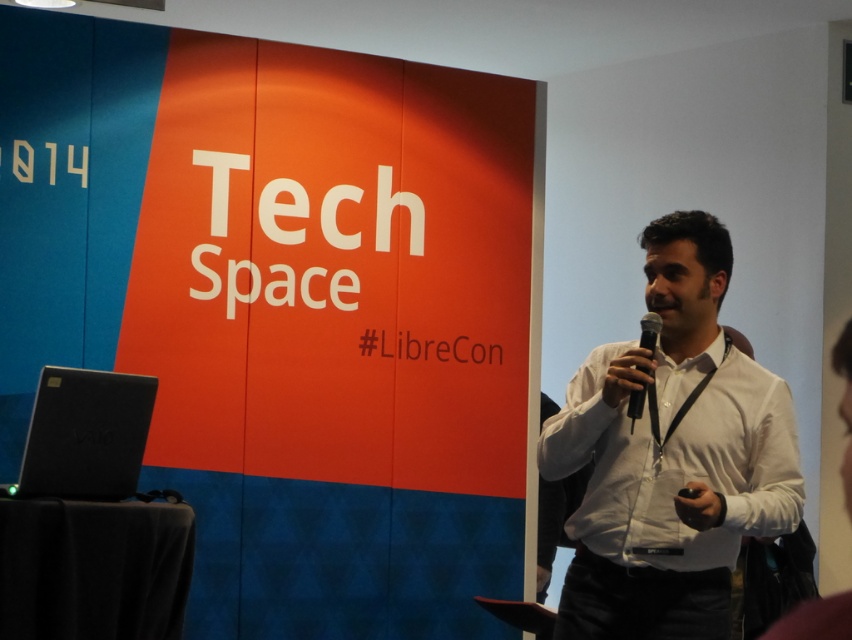
Question: Where is white shirt at center located in relation to black matte microphone at center in the image?

Choices:
 (A) right
 (B) left

Answer: (A)

Question: Is white shirt at center to the right of black matte microphone at center from the viewer's perspective?

Choices:
 (A) yes
 (B) no

Answer: (A)

Question: Does white shirt at center have a smaller size compared to black matte microphone at center?

Choices:
 (A) no
 (B) yes

Answer: (A)

Question: Which object appears farthest from the camera in this image?

Choices:
 (A) black matte microphone at center
 (B) white shirt at center

Answer: (A)